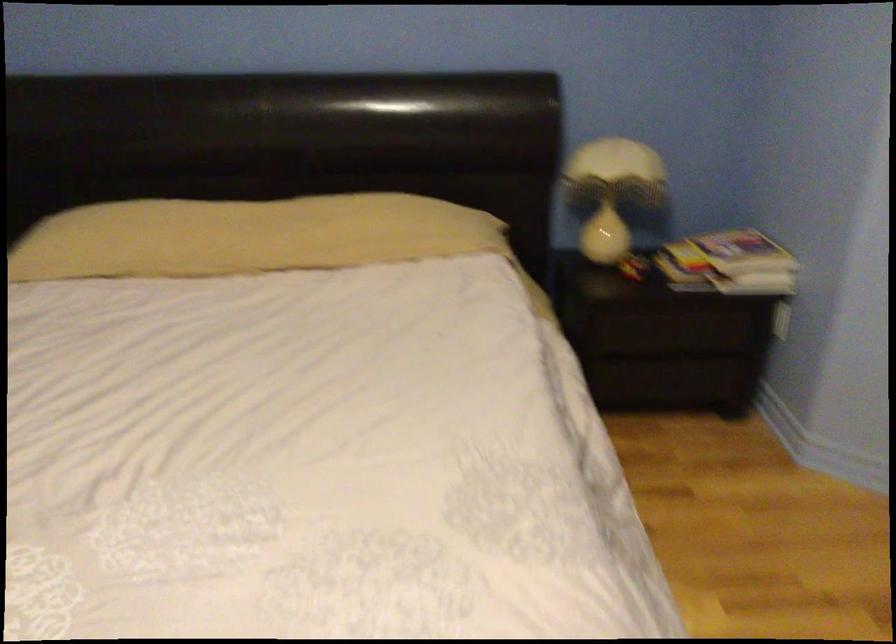
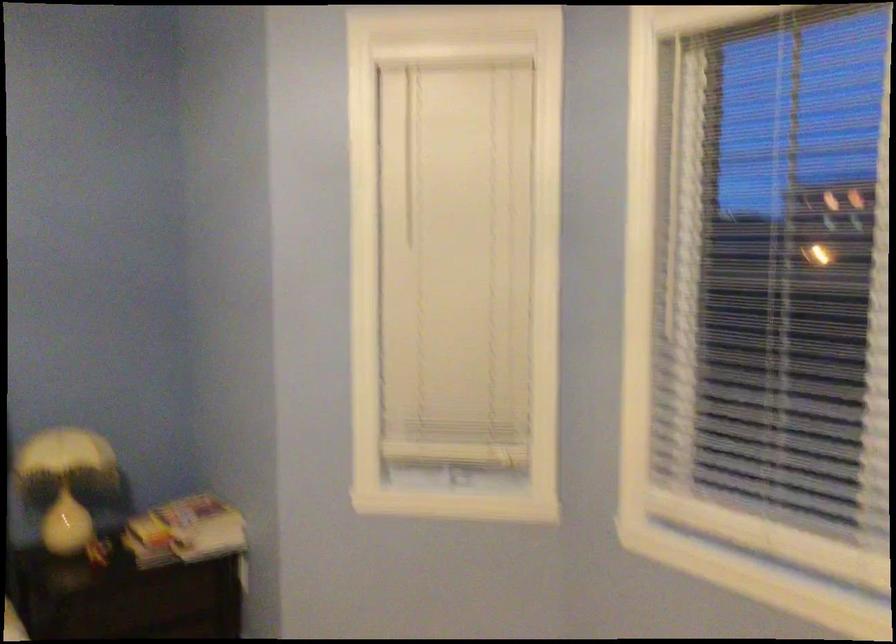
Based on the continuous images, in which direction is the camera rotating?

The camera rotated toward right-up.